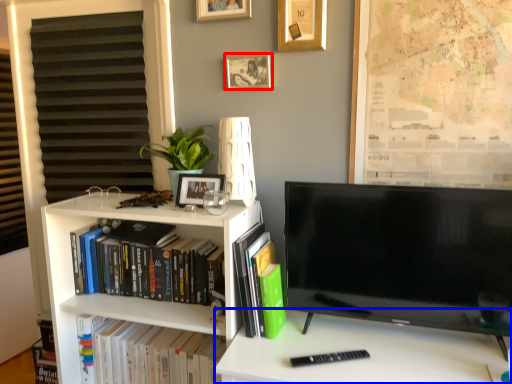
Question: Which object is closer to the camera taking this photo, picture frame (highlighted by a red box) or desk (highlighted by a blue box)?

Choices:
 (A) picture frame
 (B) desk

Answer: (B)